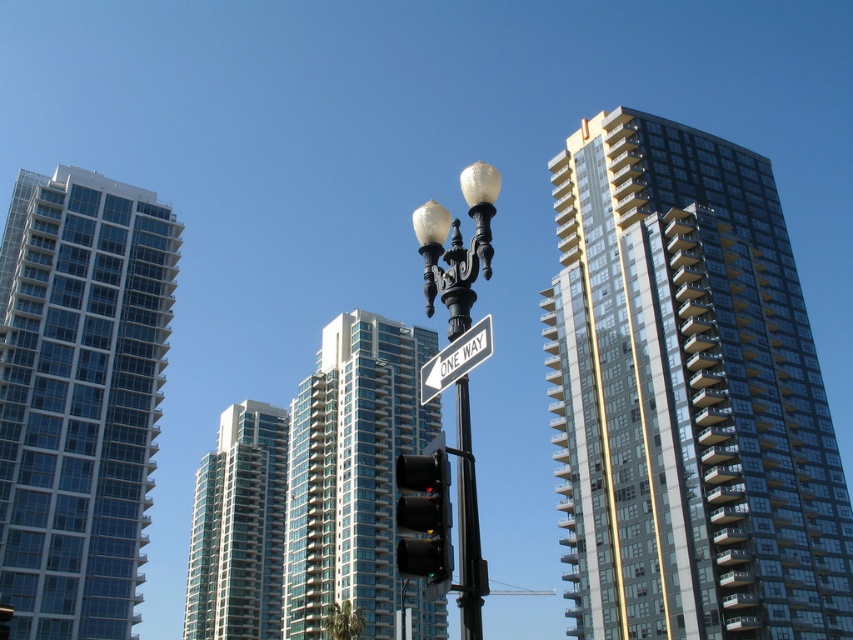
Question: Can you confirm if clear glass building at left is wider than glassy steel building at center?

Choices:
 (A) no
 (B) yes

Answer: (A)

Question: Is black glass traffic light at center below white plastic street sign at center?

Choices:
 (A) no
 (B) yes

Answer: (A)

Question: Is the position of glassy steel building at center more distant than that of white plastic street sign at center?

Choices:
 (A) no
 (B) yes

Answer: (B)

Question: Which point appears farthest from the camera in this image?

Choices:
 (A) (144, 326)
 (B) (422, 365)
 (C) (572, 436)

Answer: (A)

Question: Considering the real-world distances, which object is closest to the black glass traffic light at center?

Choices:
 (A) clear glass building at left
 (B) glassy reflective building at upper right
 (C) glassy steel building at center
 (D) white plastic street sign at center

Answer: (D)

Question: Which point is closer to the camera?

Choices:
 (A) glassy reflective building at upper right
 (B) black metal pole at center
 (C) clear glass building at left
 (D) white plastic street sign at center

Answer: (B)